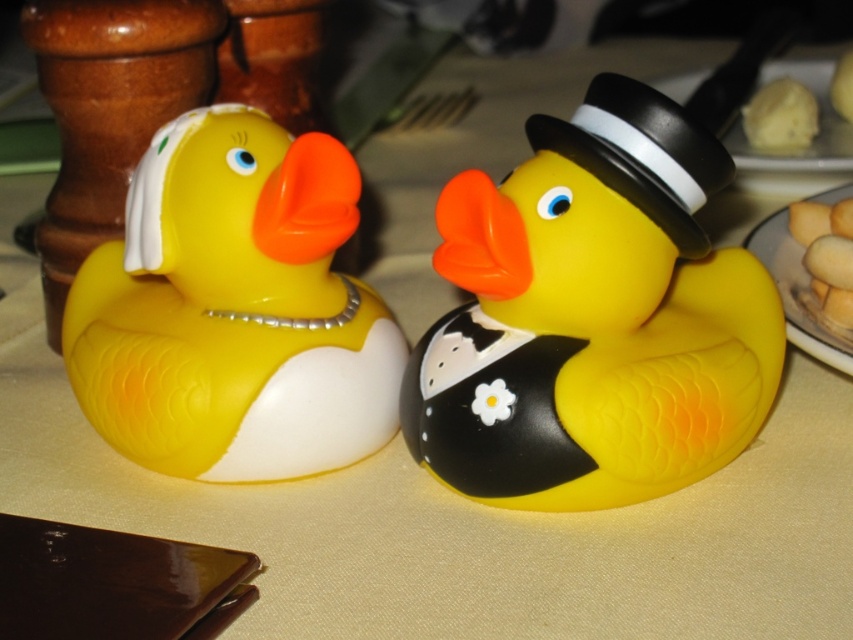
You are a chef preparing a dessert platter and need to place both the matte white porcelain at right and the yellow sponge cake at upper right on the same shelf. Which object should you place lower to ensure stability?

The matte white porcelain at right should be placed lower because it is taller than the yellow sponge cake at upper right, so placing it lower would provide better stability.

You are a guest at a wedding reception and want to take a photo with the black matte dress hat at upper right and the yellow sponge cake at upper right. Since you want both items to be clearly visible in the photo, which item should you focus on to ensure it doesn

The black matte dress hat at upper right is taller than the yellow sponge cake at upper right, so you should focus on the taller black matte dress hat at upper right to ensure both are in frame.